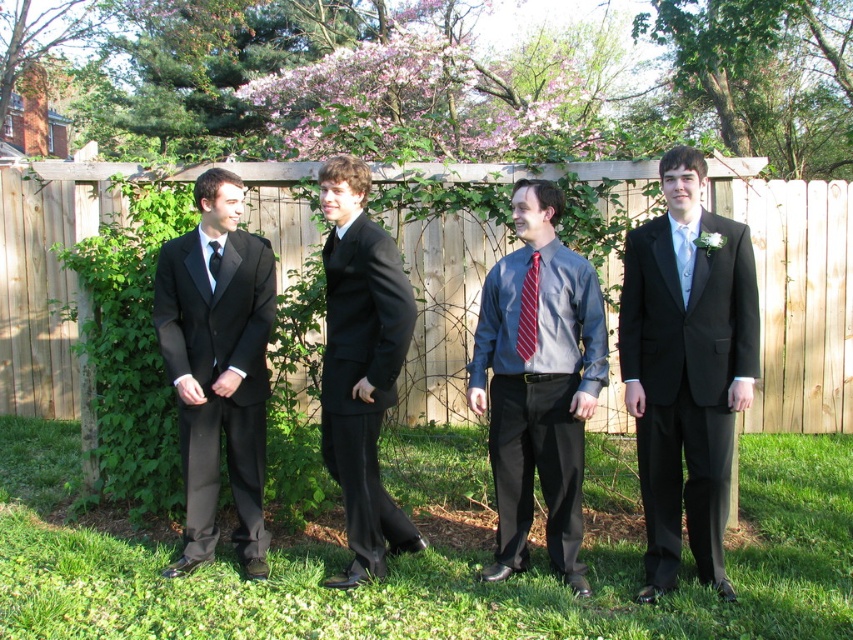
You are a photographer at a wedding event. You need to capture a photo of the red striped tie at center without the wooden fence at center appearing in the background. Is this possible based on their positions?

The wooden fence at center is above the red striped tie at center, so if you position the camera to focus on the red striped tie at center and angle it slightly downward, the fence should not be visible in the background.

You are a photographer at a wedding trying to capture the matte black suit at left and the matte black tie at left. Since both are matte black, how can you distinguish which one is closer to you?

The matte black suit at left is in front of the matte black tie at left, so the suit is closer to you than the tie.